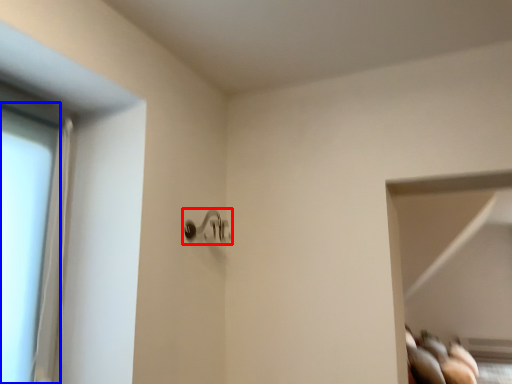
Question: Which object is closer to the camera taking this photo, door handle (highlighted by a red box) or glass door (highlighted by a blue box)?

Choices:
 (A) door handle
 (B) glass door

Answer: (B)